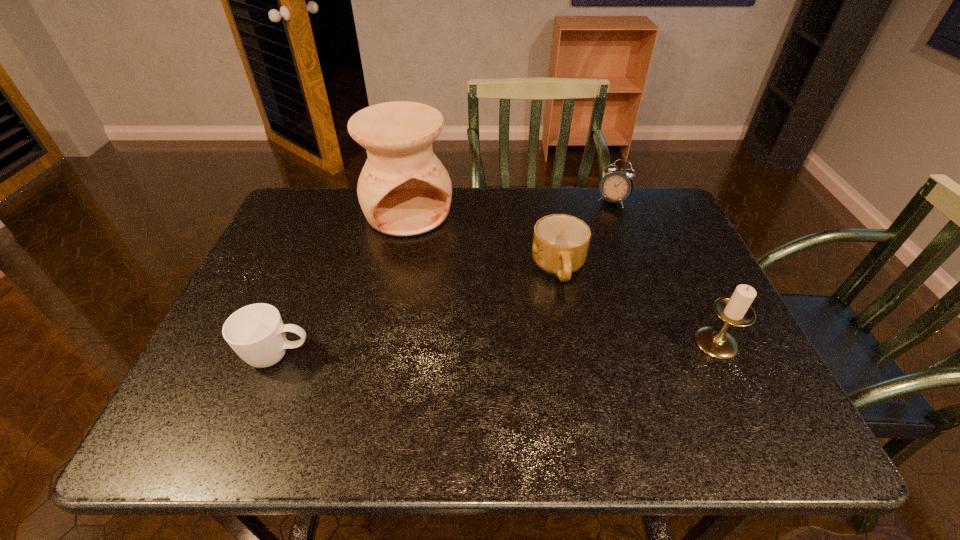
Where is `vacant space located 0.090m on the side with the handle of the third nearest object`? This screenshot has height=540, width=960. vacant space located 0.090m on the side with the handle of the third nearest object is located at coordinates (555, 322).

At what (x,y) coordinates should I click in order to perform the action: click on vacant area situated on the side with the handle of the third nearest object. Please return your answer as a coordinate pair (x, y). Looking at the image, I should click on (555, 326).

This screenshot has height=540, width=960. I want to click on blank space located on the side with the handle of the third nearest object, so click(552, 350).

In order to click on free location located 0.330m on the face of the fourth object from left to right in this screenshot , I will do `click(569, 273)`.

Where is `vacant space located 0.050m on the face of the fourth object from left to right`? vacant space located 0.050m on the face of the fourth object from left to right is located at coordinates (602, 217).

The image size is (960, 540). In order to click on vacant space located on the face of the fourth object from left to right in this screenshot , I will do click(x=587, y=243).

Find the location of `vacant region located at the open side of the fourth object from right to left`. vacant region located at the open side of the fourth object from right to left is located at coordinates (461, 312).

At what (x,y) coordinates should I click in order to perform the action: click on blank area located 0.260m at the open side of the fourth object from right to left. Please return your answer as a coordinate pair (x, y). Image resolution: width=960 pixels, height=540 pixels. Looking at the image, I should click on (453, 298).

Identify the location of vacant space located at the open side of the fourth object from right to left. This screenshot has height=540, width=960. (449, 290).

The height and width of the screenshot is (540, 960). Identify the location of alarm clock that is at the far edge. (616, 186).